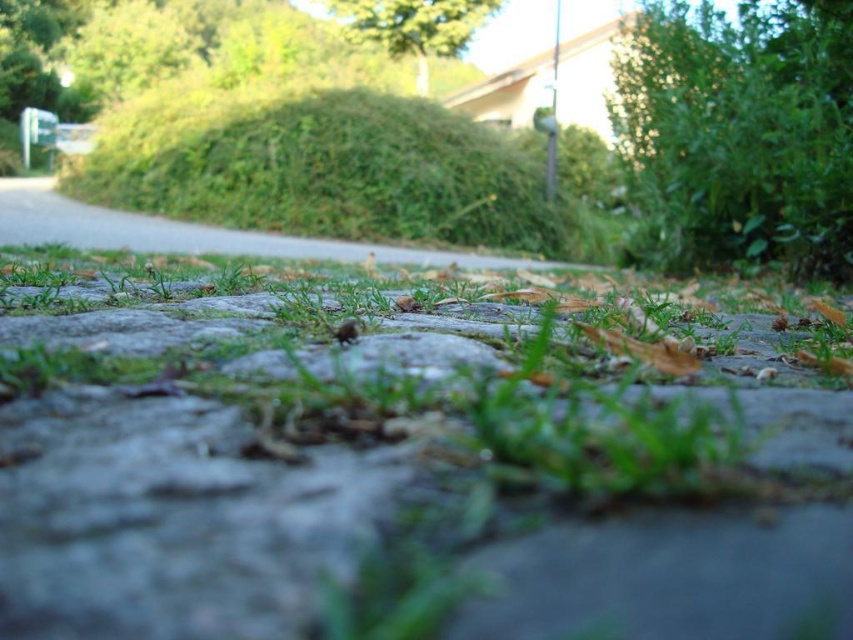
You are a gardener who needs to mow the lawn. You see two areas of grass in the image, the green grass at center and the green leafy grass at center. Which area requires more attention because it is taller?

The green leafy grass at center is taller than the green grass at center, so it requires more attention.

You are a gardener who needs to mow the lawn. You see the green grass at center and the green leafy grass at center. Which one is closer to the ground?

The green grass at center is closer to the ground because it is positioned below the green leafy grass at center.